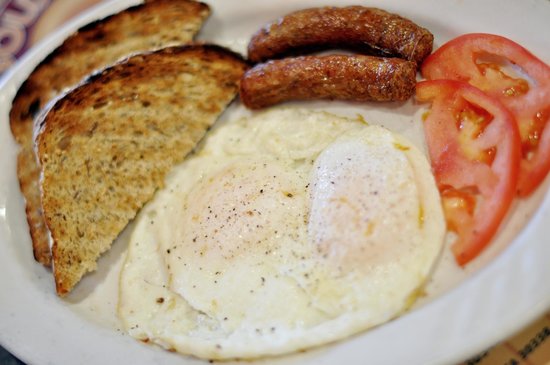
Locate an element on the screen. The height and width of the screenshot is (365, 550). corners is located at coordinates (538, 357), (538, 10), (14, 27), (6, 354).